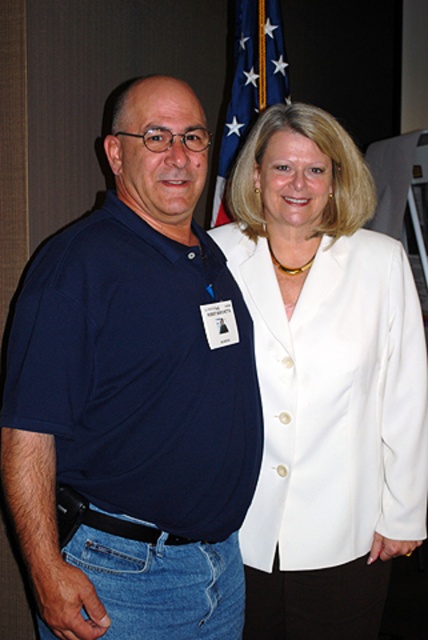
Does white matte blazer at center have a greater width compared to blue fabric flag at upper center?

Correct, the width of white matte blazer at center exceeds that of blue fabric flag at upper center.

Is white matte blazer at center taller than blue fabric flag at upper center?

Correct, white matte blazer at center is much taller as blue fabric flag at upper center.

Does point (415, 410) lie behind point (282, 96)?

No, (415, 410) is closer to viewer.

The image size is (428, 640). Find the location of `white matte blazer at center`. white matte blazer at center is located at coordinates (324, 380).

Between matte blue shirt at center and blue fabric flag at upper center, which one is positioned lower?

Positioned lower is matte blue shirt at center.

Is matte blue shirt at center further to camera compared to blue fabric flag at upper center?

No, it is not.

I want to click on matte blue shirt at center, so click(134, 397).

Is matte blue shirt at center taller than white matte blazer at center?

Incorrect, matte blue shirt at center's height is not larger of white matte blazer at center's.

Between matte blue shirt at center and white matte blazer at center, which one has more height?

white matte blazer at center is taller.

Locate an element on the screen. This screenshot has width=428, height=640. matte blue shirt at center is located at coordinates (134, 397).

Find the location of `matte blue shirt at center`. matte blue shirt at center is located at coordinates (134, 397).